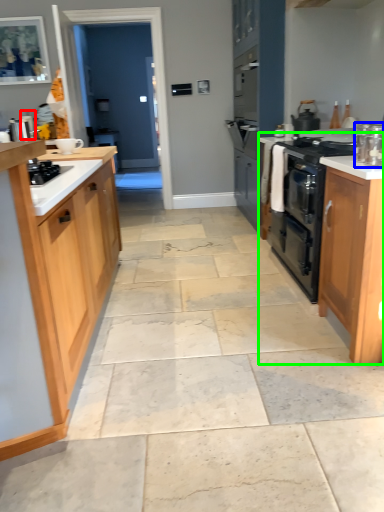
Question: Which object is positioned farthest from appliance (highlighted by a red box)? Select from kitchen appliance (highlighted by a blue box) and counter (highlighted by a green box).

Choices:
 (A) kitchen appliance
 (B) counter

Answer: (A)